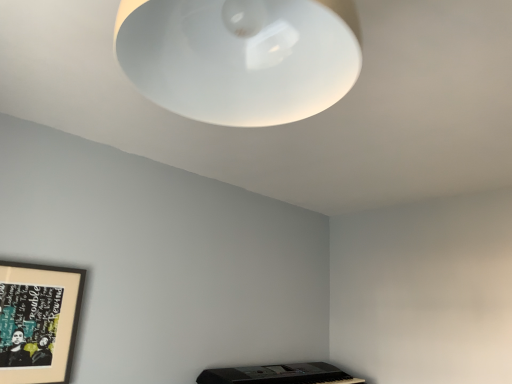
Question: Should I look upward or downward to see wooden framed artwork at lower left?

Choices:
 (A) down
 (B) up

Answer: (A)

Question: Can you confirm if white matte lampshade at upper center is taller than wooden framed artwork at lower left?

Choices:
 (A) no
 (B) yes

Answer: (A)

Question: From the image's perspective, is white matte lampshade at upper center on top of wooden framed artwork at lower left?

Choices:
 (A) yes
 (B) no

Answer: (A)

Question: Is white matte lampshade at upper center wider than wooden framed artwork at lower left?

Choices:
 (A) no
 (B) yes

Answer: (B)

Question: Does white matte lampshade at upper center have a larger size compared to wooden framed artwork at lower left?

Choices:
 (A) no
 (B) yes

Answer: (B)

Question: Is white matte lampshade at upper center positioned far away from wooden framed artwork at lower left?

Choices:
 (A) yes
 (B) no

Answer: (A)

Question: Is white matte lampshade at upper center next to wooden framed artwork at lower left?

Choices:
 (A) no
 (B) yes

Answer: (A)

Question: From a real-world perspective, does wooden framed artwork at lower left sit lower than white matte lampshade at upper center?

Choices:
 (A) no
 (B) yes

Answer: (B)

Question: Can you see wooden framed artwork at lower left touching white matte lampshade at upper center?

Choices:
 (A) no
 (B) yes

Answer: (A)

Question: Is wooden framed artwork at lower left at the left side of white matte lampshade at upper center?

Choices:
 (A) yes
 (B) no

Answer: (A)

Question: Is wooden framed artwork at lower left wider than white matte lampshade at upper center?

Choices:
 (A) yes
 (B) no

Answer: (B)

Question: From the image's perspective, is wooden framed artwork at lower left under white matte lampshade at upper center?

Choices:
 (A) yes
 (B) no

Answer: (A)

Question: Does wooden framed artwork at lower left have a lesser height compared to white matte lampshade at upper center?

Choices:
 (A) yes
 (B) no

Answer: (B)

Question: From the image's perspective, relative to wooden framed artwork at lower left, is white matte lampshade at upper center above or below?

Choices:
 (A) above
 (B) below

Answer: (A)